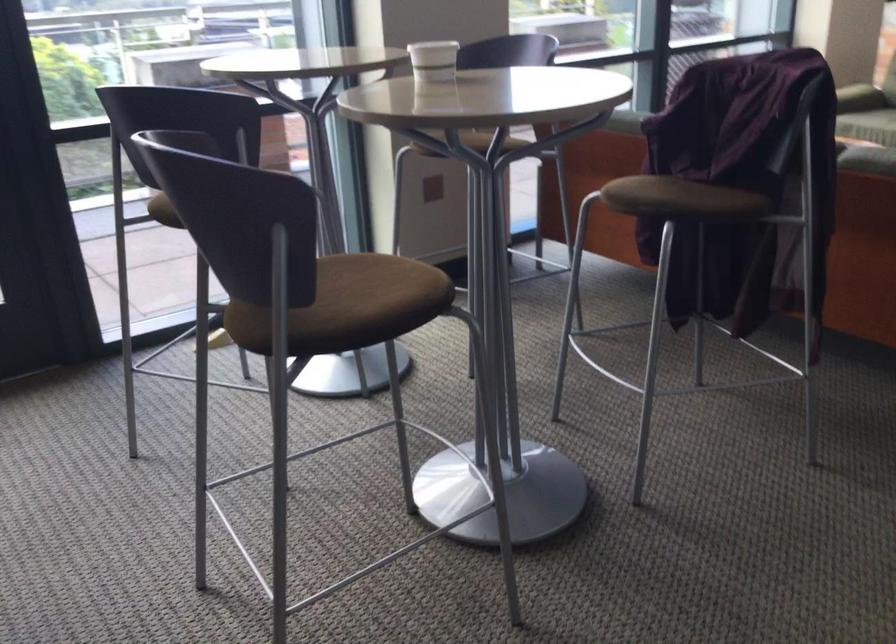
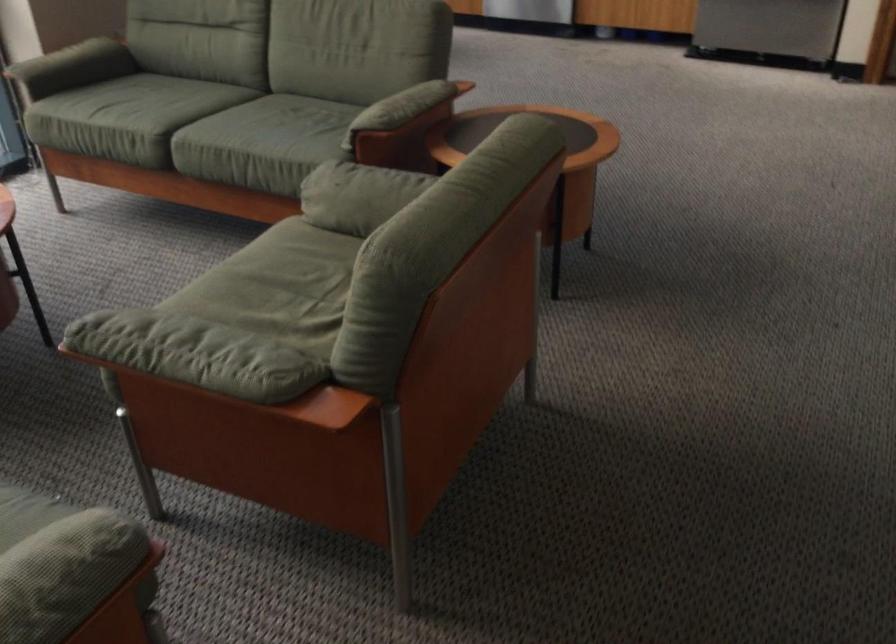
What movement of the cameraman would produce the second image?

The movement direction of the cameraman is right, forward.